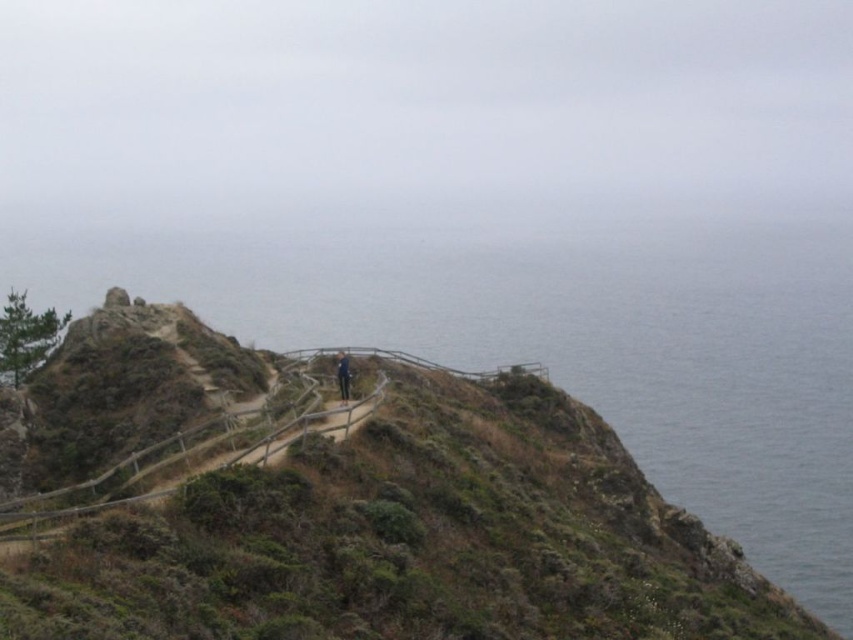
You are standing at the point marked as point [577,349] in the coastal scene. What do you see in front of you?

You see gray water at upper right in front of you at point [577,349].